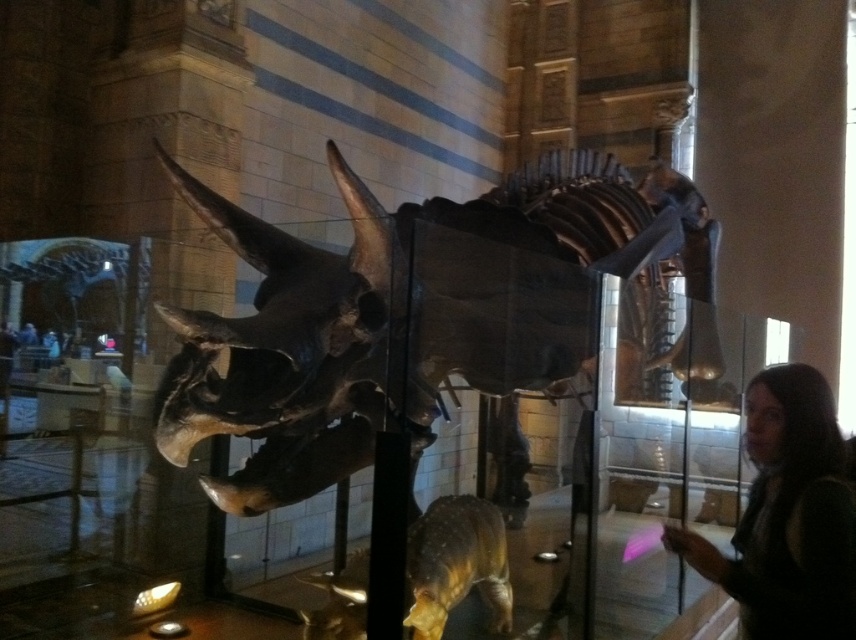
Is shiny metallic dinosaur skeleton at center positioned at the back of dark brown hair at lower right?

No, shiny metallic dinosaur skeleton at center is closer to the viewer.

Based on the photo, is shiny metallic dinosaur skeleton at center to the left of dark brown hair at lower right from the viewer's perspective?

Correct, you'll find shiny metallic dinosaur skeleton at center to the left of dark brown hair at lower right.

Where is `shiny metallic dinosaur skeleton at center`? Image resolution: width=856 pixels, height=640 pixels. shiny metallic dinosaur skeleton at center is located at coordinates (419, 317).